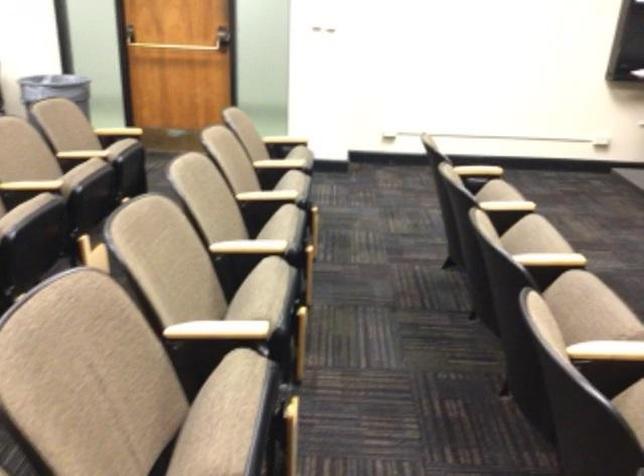
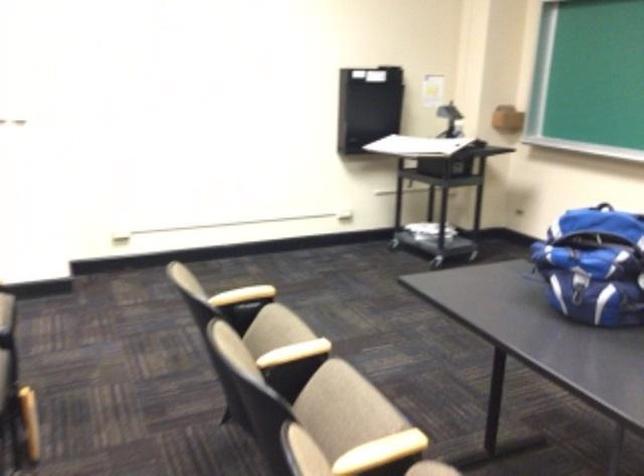
Question: The images are taken continuously from a first-person perspective. In which direction is your viewpoint rotating?

Choices:
 (A) Left
 (B) Right
 (C) Up
 (D) Down

Answer: (B)